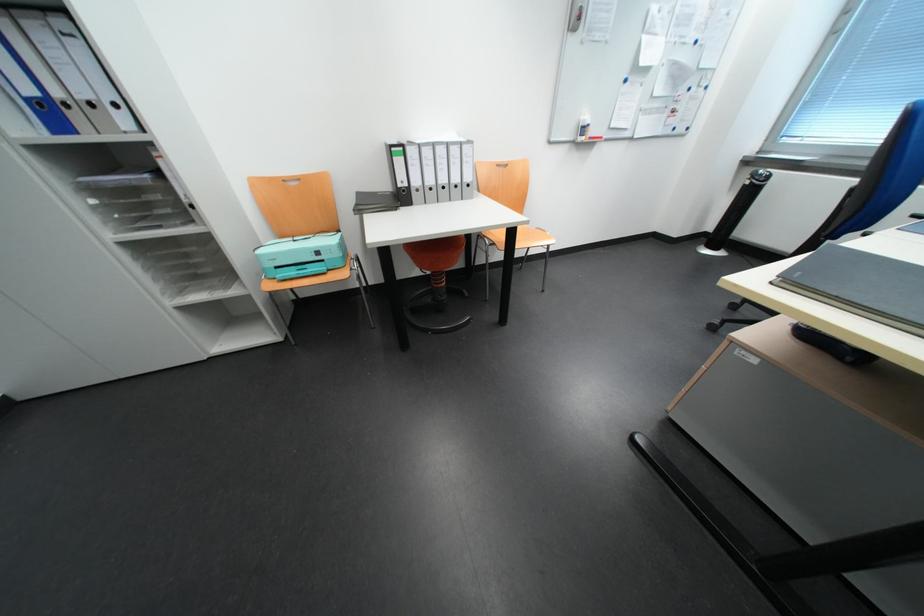
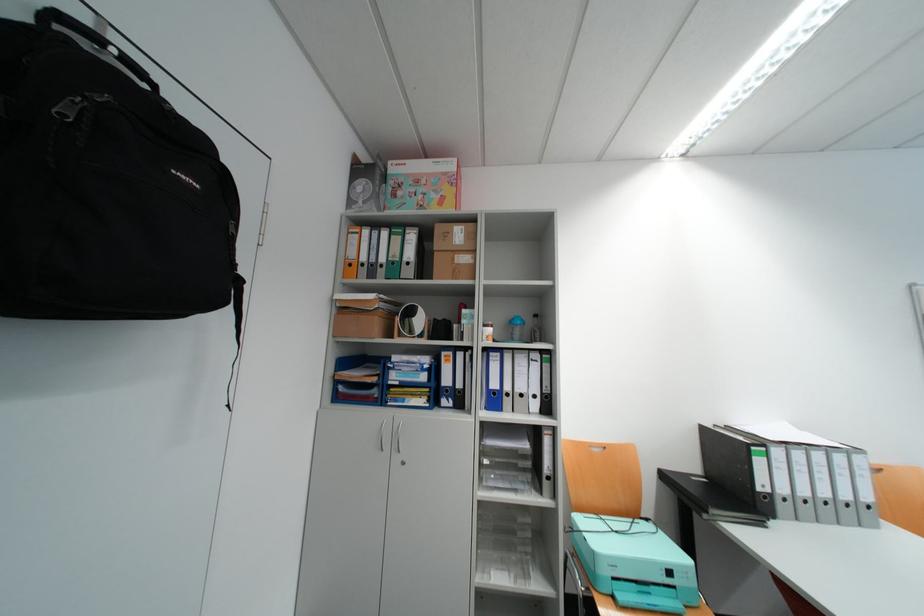
Find the pixel in the second image that matches (x=296, y=180) in the first image.

(602, 447)